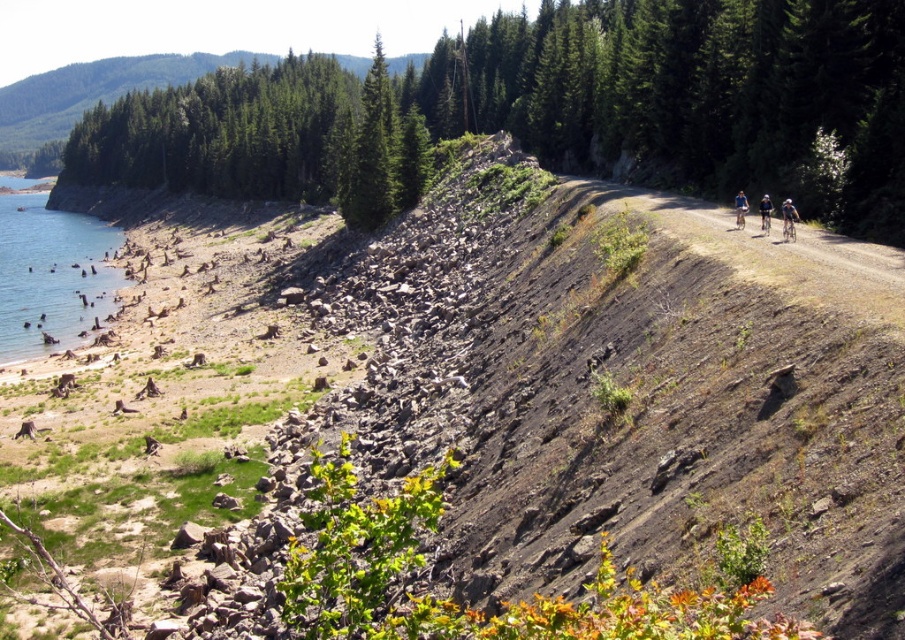
Is blue matte bicycle at center-right further to camera compared to light blue fabric helmet at upper right?

Yes.

Who is lower down, blue matte bicycle at center-right or light blue fabric helmet at upper right?

light blue fabric helmet at upper right

Who is more distant from viewer, (738, 225) or (761, 204)?

The point (761, 204) is more distant.

Image resolution: width=905 pixels, height=640 pixels. In order to click on blue matte bicycle at center-right in this screenshot , I will do `click(740, 209)`.

Is point (792, 227) more distant than point (768, 200)?

No, it is not.

Is blue fabric helmet at upper right taller than light blue fabric helmet at upper right?

Incorrect, blue fabric helmet at upper right's height is not larger of light blue fabric helmet at upper right's.

Is point (784, 212) farther from camera compared to point (761, 225)?

No, (784, 212) is in front of (761, 225).

The width and height of the screenshot is (905, 640). Find the location of `blue fabric helmet at upper right`. blue fabric helmet at upper right is located at coordinates (788, 220).

Can you confirm if blue fabric helmet at upper right is smaller than blue matte bicycle at center-right?

Yes, blue fabric helmet at upper right is smaller than blue matte bicycle at center-right.

Which is behind, point (788, 196) or point (738, 220)?

The point (788, 196) is behind.

Find the location of a particular element. The height and width of the screenshot is (640, 905). blue fabric helmet at upper right is located at coordinates (788, 220).